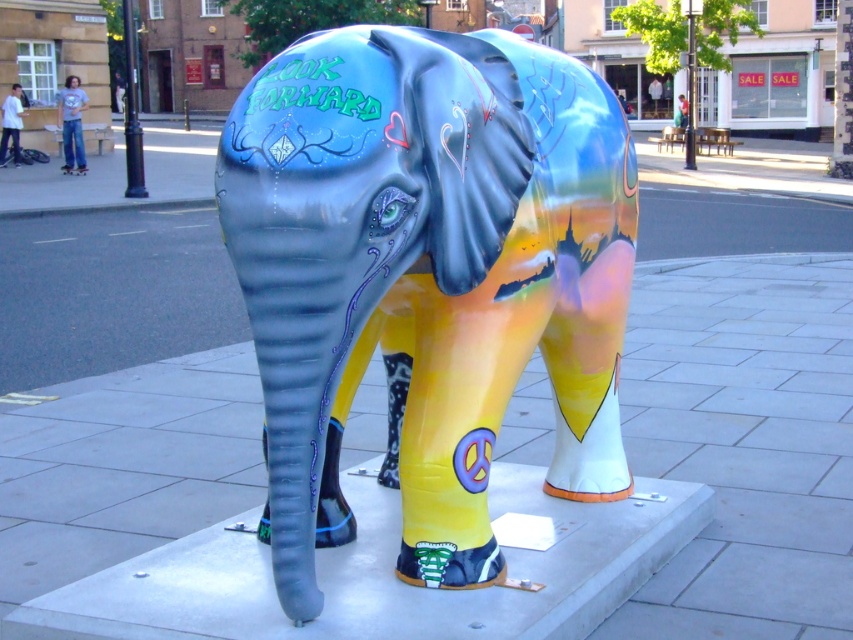
You are a delivery person standing at the edge of the sidewalk. You need to place a package between the shiny metallic elephant at center and the smooth concrete elephant at center. The package requires 5 feet of space. Is there enough space between them to place the package?

The shiny metallic elephant at center is 4.83 feet away from the smooth concrete elephant at center. Since the required space for the package is 5 feet, there is not enough space between them to place the package.

You are a pedestrian standing on the sidewalk in front of the elephant sculpture. You want to touch both the shiny metallic elephant at center and the smooth concrete elephant at center. Which one should you reach for first?

You should reach for the shiny metallic elephant at center first because it is closer to you than the smooth concrete elephant at center.